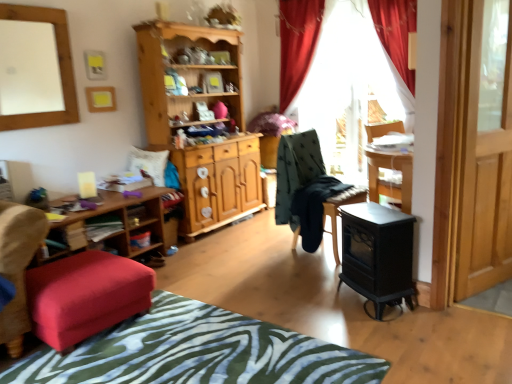
Question: Is red velvet curtain at upper center bigger than zebra print fabric at lower center?

Choices:
 (A) yes
 (B) no

Answer: (A)

Question: Is red velvet curtain at upper center outside zebra print fabric at lower center?

Choices:
 (A) yes
 (B) no

Answer: (A)

Question: From a real-world perspective, is red velvet curtain at upper center physically below zebra print fabric at lower center?

Choices:
 (A) yes
 (B) no

Answer: (B)

Question: Are red velvet curtain at upper center and zebra print fabric at lower center making contact?

Choices:
 (A) yes
 (B) no

Answer: (B)

Question: Can you confirm if red velvet curtain at upper center is smaller than zebra print fabric at lower center?

Choices:
 (A) no
 (B) yes

Answer: (A)

Question: Based on their sizes in the image, would you say white matte mirror at upper left is bigger or smaller than black matte wood stove at lower right?

Choices:
 (A) small
 (B) big

Answer: (A)

Question: From a real-world perspective, is white matte mirror at upper left physically located above or below black matte wood stove at lower right?

Choices:
 (A) above
 (B) below

Answer: (A)

Question: Considering their positions, is white matte mirror at upper left located in front of or behind black matte wood stove at lower right?

Choices:
 (A) front
 (B) behind

Answer: (B)

Question: Is white matte mirror at upper left wider or thinner than black matte wood stove at lower right?

Choices:
 (A) wide
 (B) thin

Answer: (B)

Question: Which is correct: wooden shelf at lower left is inside wooden shelf at lower left, or outside of it?

Choices:
 (A) outside
 (B) inside

Answer: (B)

Question: Is wooden shelf at lower left wider or thinner than wooden shelf at lower left?

Choices:
 (A) wide
 (B) thin

Answer: (B)

Question: From a real-world perspective, relative to wooden shelf at lower left, is wooden shelf at lower left vertically above or below?

Choices:
 (A) below
 (B) above

Answer: (A)

Question: Considering their positions, is wooden shelf at lower left located in front of or behind wooden shelf at lower left?

Choices:
 (A) front
 (B) behind

Answer: (B)

Question: From a real-world perspective, is transparent glass door at right above or below white matte mirror at upper left?

Choices:
 (A) below
 (B) above

Answer: (A)

Question: From the image's perspective, relative to white matte mirror at upper left, is transparent glass door at right above or below?

Choices:
 (A) below
 (B) above

Answer: (A)